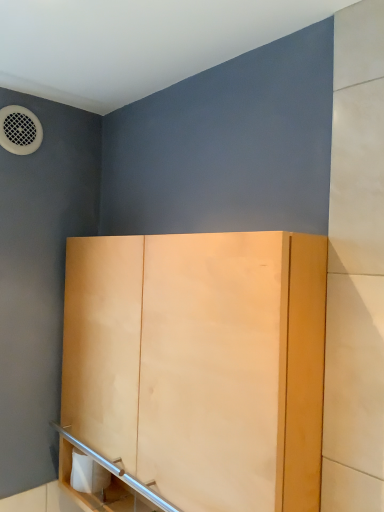
What do you see at coordinates (88, 474) in the screenshot? This screenshot has height=512, width=384. I see `white matte toilet paper at lower left` at bounding box center [88, 474].

Locate an element on the screen. The height and width of the screenshot is (512, 384). white matte toilet paper at lower left is located at coordinates (88, 474).

The height and width of the screenshot is (512, 384). Describe the element at coordinates (200, 362) in the screenshot. I see `light wood cabinet at center` at that location.

Where is `light wood cabinet at center`? This screenshot has height=512, width=384. light wood cabinet at center is located at coordinates (200, 362).

Find the location of `white matte toilet paper at lower left`. white matte toilet paper at lower left is located at coordinates (88, 474).

Is light wood cabinet at center at the right side of white matte toilet paper at lower left?

Yes.

Considering their positions, is light wood cabinet at center located in front of or behind white matte toilet paper at lower left?

Visually, light wood cabinet at center is located in front of white matte toilet paper at lower left.

Considering the points (139, 355) and (84, 475), which point is behind, point (139, 355) or point (84, 475)?

Positioned behind is point (84, 475).

From the image's perspective, is light wood cabinet at center above white matte toilet paper at lower left?

Yes.

From the picture: From a real-world perspective, who is located higher, light wood cabinet at center or white matte toilet paper at lower left?

light wood cabinet at center is physically above.

Can you confirm if light wood cabinet at center is thinner than white matte toilet paper at lower left?

In fact, light wood cabinet at center might be wider than white matte toilet paper at lower left.

Is light wood cabinet at center taller or shorter than white matte toilet paper at lower left?

Considering their sizes, light wood cabinet at center has more height than white matte toilet paper at lower left.

Who is bigger, light wood cabinet at center or white matte toilet paper at lower left?

light wood cabinet at center.

Is light wood cabinet at center located outside white matte toilet paper at lower left?

Yes.

Is light wood cabinet at center placed right next to white matte toilet paper at lower left?

No, light wood cabinet at center is not with white matte toilet paper at lower left.

From the picture: Is light wood cabinet at center looking in the opposite direction of white matte toilet paper at lower left?

That's right, light wood cabinet at center is facing away from white matte toilet paper at lower left.

How different are the orientations of light wood cabinet at center and white matte toilet paper at lower left in degrees?

There is a 2.72-degree angle between the facing directions of light wood cabinet at center and white matte toilet paper at lower left.

Based on the photo, how far apart are light wood cabinet at center and white matte toilet paper at lower left?

The distance of light wood cabinet at center from white matte toilet paper at lower left is 51.46 centimeters.

At what (x,y) coordinates should I click in order to perform the action: click on toilet paper behind the light wood cabinet at center. Please return your answer as a coordinate pair (x, y). Looking at the image, I should click on (88, 474).

Considering the positions of objects white matte toilet paper at lower left and light wood cabinet at center in the image provided, who is more to the right, white matte toilet paper at lower left or light wood cabinet at center?

light wood cabinet at center is more to the right.

Which object is more forward, white matte toilet paper at lower left or light wood cabinet at center?

light wood cabinet at center is in front.

Is point (95, 479) positioned before point (135, 447)?

No, it is behind (135, 447).

From the image's perspective, which one is positioned lower, white matte toilet paper at lower left or light wood cabinet at center?

From the image's view, white matte toilet paper at lower left is below.

From a real-world perspective, which object stands above the other?

From a 3D spatial view, light wood cabinet at center is above.

Considering the relative sizes of white matte toilet paper at lower left and light wood cabinet at center in the image provided, is white matte toilet paper at lower left thinner than light wood cabinet at center?

Correct, the width of white matte toilet paper at lower left is less than that of light wood cabinet at center.

Does white matte toilet paper at lower left have a lesser height compared to light wood cabinet at center?

Yes.

Is white matte toilet paper at lower left bigger or smaller than light wood cabinet at center?

white matte toilet paper at lower left is smaller than light wood cabinet at center.

Is white matte toilet paper at lower left completely or partially outside of light wood cabinet at center?

No.

Is white matte toilet paper at lower left far from light wood cabinet at center?

They are positioned close to each other.

Could you tell me if white matte toilet paper at lower left is turned towards light wood cabinet at center?

Yes, white matte toilet paper at lower left is oriented towards light wood cabinet at center.

Based on the photo, how many degrees apart are the facing directions of white matte toilet paper at lower left and light wood cabinet at center?

The facing directions of white matte toilet paper at lower left and light wood cabinet at center are 2.72 degrees apart.

Locate an element on the screen. toilet paper below the light wood cabinet at center (from a real-world perspective) is located at coordinates (88, 474).

Where is `toilet paper behind the light wood cabinet at center`? Image resolution: width=384 pixels, height=512 pixels. toilet paper behind the light wood cabinet at center is located at coordinates (88, 474).

Find the location of `cupboard lying above the white matte toilet paper at lower left (from the image's perspective)`. cupboard lying above the white matte toilet paper at lower left (from the image's perspective) is located at coordinates (200, 362).